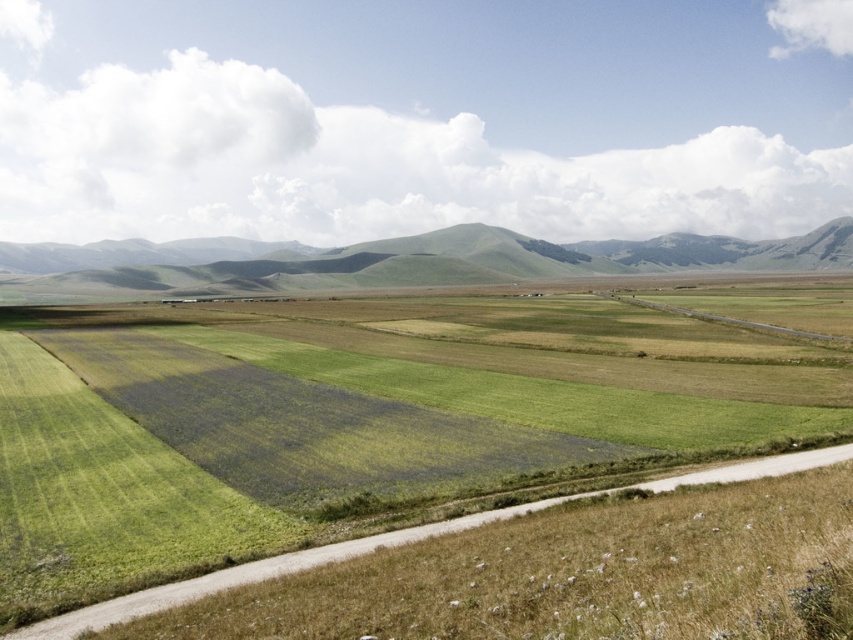
Does green grassland at center have a larger size compared to green grassy hill at center?

No.

Is green grassland at center positioned in front of green grassy hill at center?

That is True.

Which is in front, point (28, 508) or point (572, 262)?

Point (28, 508) is more forward.

Identify the location of green grassland at center. (358, 419).